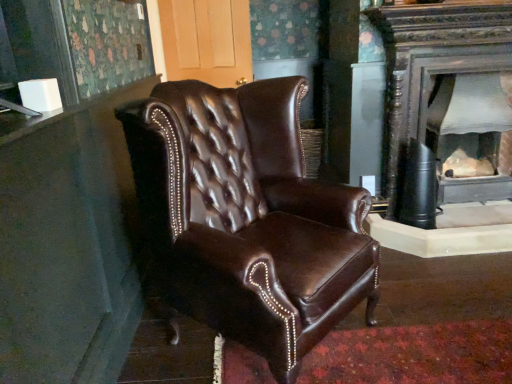
Question: From the image's perspective, would you say brown leather chair at center is shown under matte black fireplace at right?

Choices:
 (A) no
 (B) yes

Answer: (B)

Question: Is brown leather chair at center to the right of matte black fireplace at right from the viewer's perspective?

Choices:
 (A) yes
 (B) no

Answer: (B)

Question: Is brown leather chair at center positioned behind matte black fireplace at right?

Choices:
 (A) no
 (B) yes

Answer: (A)

Question: Is brown leather chair at center closer to the viewer compared to matte black fireplace at right?

Choices:
 (A) yes
 (B) no

Answer: (A)

Question: Considering the relative sizes of brown leather chair at center and matte black fireplace at right in the image provided, is brown leather chair at center smaller than matte black fireplace at right?

Choices:
 (A) yes
 (B) no

Answer: (B)

Question: Is brown leather chair at center facing towards matte black fireplace at right?

Choices:
 (A) no
 (B) yes

Answer: (A)

Question: From a real-world perspective, does matte black fireplace at right sit lower than brown leather chair at center?

Choices:
 (A) yes
 (B) no

Answer: (A)

Question: Would you say matte black fireplace at right contains brown leather chair at center?

Choices:
 (A) yes
 (B) no

Answer: (B)

Question: Is the position of matte black fireplace at right less distant than that of brown leather chair at center?

Choices:
 (A) no
 (B) yes

Answer: (A)

Question: Are matte black fireplace at right and brown leather chair at center far apart?

Choices:
 (A) yes
 (B) no

Answer: (A)

Question: Is matte black fireplace at right bigger than brown leather chair at center?

Choices:
 (A) yes
 (B) no

Answer: (B)

Question: Does matte black fireplace at right have a greater width compared to brown leather chair at center?

Choices:
 (A) yes
 (B) no

Answer: (B)

Question: From the image's perspective, is brown leather chair at center positioned above or below matte black fireplace at right?

Choices:
 (A) below
 (B) above

Answer: (A)